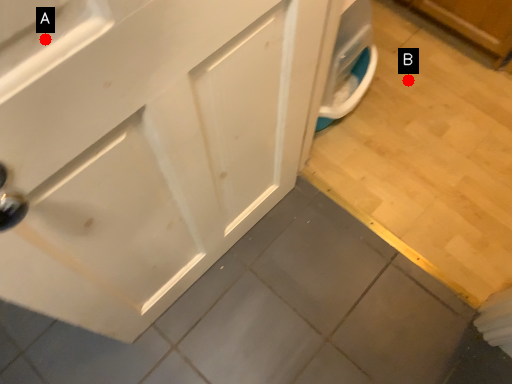
Question: Two points are circled on the image, labeled by A and B beside each circle. Among these points, which one is farthest from the camera?

Choices:
 (A) A is further
 (B) B is further

Answer: (B)